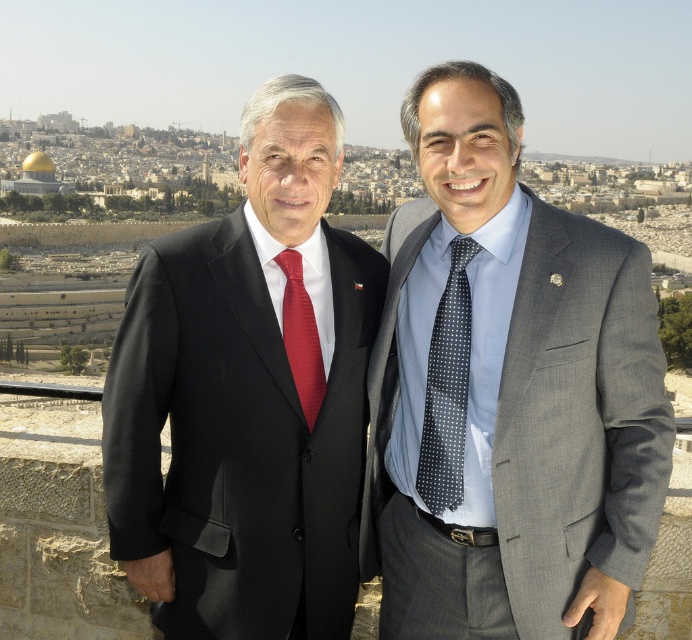
Does black matte suit at center have a greater width compared to gray textured suit at right?

No.

Who is taller, black matte suit at center or gray textured suit at right?

Standing taller between the two is black matte suit at center.

Find the location of a particular element. The height and width of the screenshot is (640, 692). black matte suit at center is located at coordinates (248, 396).

Which is below, black matte suit at center or matte red tie at center?

matte red tie at center is lower down.

Find the location of a particular element. This screenshot has height=640, width=692. black matte suit at center is located at coordinates (248, 396).

Is point (558, 212) positioned after point (311, 380)?

Yes, it is behind point (311, 380).

Can you confirm if gray textured suit at right is bigger than matte red tie at center?

Yes, gray textured suit at right is bigger than matte red tie at center.

Where is `gray textured suit at right`? gray textured suit at right is located at coordinates [579, 419].